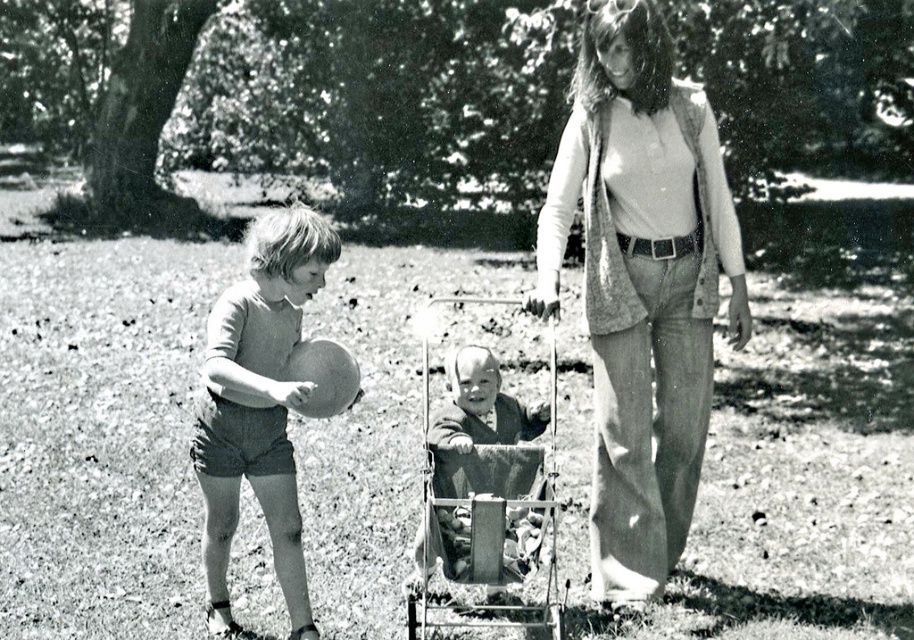
You are a photographer trying to capture a closeup of the knitted sweater at center and the metallic silver baby carriage at center in the scene. If you want to ensure both objects are fully in frame without cropping, which object requires a wider lens to accommodate its size?

The knitted sweater at center might be wider than metallic silver baby carriage at center, so you would need a wider lens to accommodate the knitted sweater at center to ensure it fits fully in the frame.

You are a photographer trying to capture a closeup of the smooth beige shorts at left and the metallic silver baby carriage at center. Which object should you zoom in on first if you want to focus on the wider one?

The smooth beige shorts at left might be wider than metallic silver baby carriage at center, so you should zoom in on the smooth beige shorts at left first to focus on the wider object.